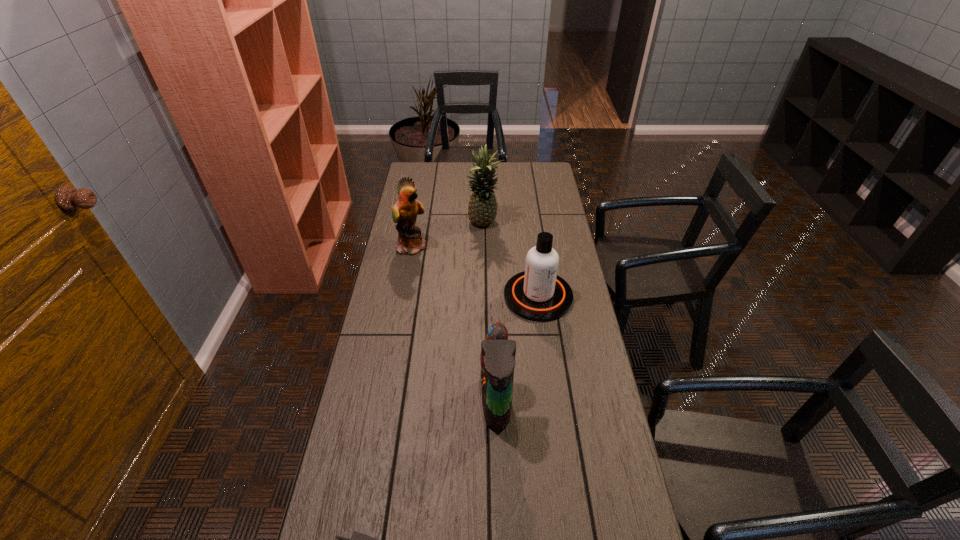
Find the location of a particular element. vacant space located 0.360m at the face of the second nearest object is located at coordinates (361, 402).

Where is `free point located at the face of the second nearest object`? This screenshot has height=540, width=960. free point located at the face of the second nearest object is located at coordinates (444, 402).

Where is `object present at the left edge`? This screenshot has height=540, width=960. object present at the left edge is located at coordinates (404, 212).

At what (x,y) coordinates should I click in order to perform the action: click on object that is positioned at the right edge. Please return your answer as a coordinate pair (x, y). Looking at the image, I should click on (538, 294).

Where is `vacant space at the far edge`? vacant space at the far edge is located at coordinates (441, 164).

This screenshot has width=960, height=540. In the image, there is a desktop. What are the coordinates of `vacant space at the left edge` in the screenshot? It's located at [368, 516].

Locate an element on the screen. blank area at the right edge is located at coordinates (548, 211).

Locate an element on the screen. Image resolution: width=960 pixels, height=540 pixels. vacant space at the far right corner of the desktop is located at coordinates (542, 172).

At what (x,y) coordinates should I click in order to perform the action: click on empty space that is in between the shorter parrot and the pineapple. Please return your answer as a coordinate pair (x, y). This screenshot has width=960, height=540. Looking at the image, I should click on (490, 313).

Where is `free area in between the left parrot and the pineapple`? free area in between the left parrot and the pineapple is located at coordinates (448, 235).